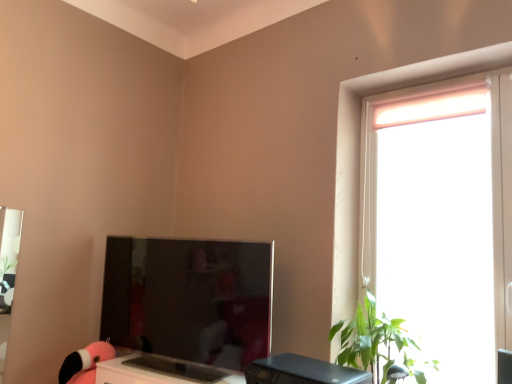
Question: Is satin black monitor at center with black plastic desktop at lower center?

Choices:
 (A) yes
 (B) no

Answer: (B)

Question: Would you say satin black monitor at center is outside black plastic desktop at lower center?

Choices:
 (A) yes
 (B) no

Answer: (A)

Question: From the image's perspective, does satin black monitor at center appear higher than black plastic desktop at lower center?

Choices:
 (A) yes
 (B) no

Answer: (A)

Question: Are satin black monitor at center and black plastic desktop at lower center located far from each other?

Choices:
 (A) no
 (B) yes

Answer: (A)

Question: Is satin black monitor at center wider than black plastic desktop at lower center?

Choices:
 (A) yes
 (B) no

Answer: (B)

Question: Is green leafy plant at right taller or shorter than matte pink plush at lower left?

Choices:
 (A) short
 (B) tall

Answer: (B)

Question: Does point (347, 347) appear closer or farther from the camera than point (91, 344)?

Choices:
 (A) closer
 (B) farther

Answer: (A)

Question: Considering the positions of green leafy plant at right and matte pink plush at lower left in the image, is green leafy plant at right wider or thinner than matte pink plush at lower left?

Choices:
 (A) wide
 (B) thin

Answer: (A)

Question: Based on their sizes in the image, would you say green leafy plant at right is bigger or smaller than matte pink plush at lower left?

Choices:
 (A) small
 (B) big

Answer: (B)

Question: Based on their positions, is black plastic desktop at lower center located to the left or right of matte pink plush at lower left?

Choices:
 (A) left
 (B) right

Answer: (B)

Question: Which is correct: black plastic desktop at lower center is inside matte pink plush at lower left, or outside of it?

Choices:
 (A) inside
 (B) outside

Answer: (B)

Question: In the image, is black plastic desktop at lower center positioned in front of or behind matte pink plush at lower left?

Choices:
 (A) behind
 (B) front

Answer: (B)

Question: From their relative heights in the image, would you say black plastic desktop at lower center is taller or shorter than matte pink plush at lower left?

Choices:
 (A) short
 (B) tall

Answer: (A)

Question: Is green leafy plant at right inside or outside of black plastic desktop at lower center?

Choices:
 (A) inside
 (B) outside

Answer: (B)

Question: In terms of size, does green leafy plant at right appear bigger or smaller than black plastic desktop at lower center?

Choices:
 (A) big
 (B) small

Answer: (A)